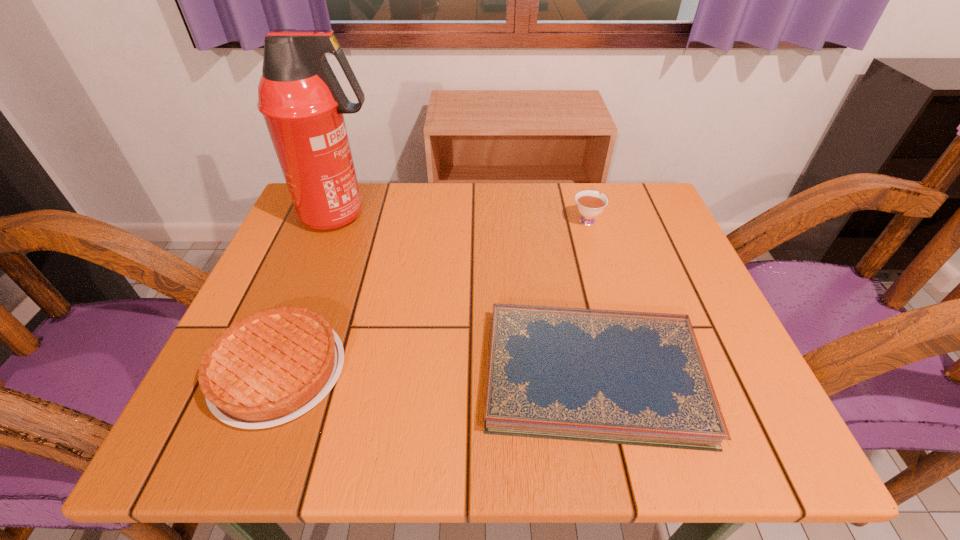
Locate an element on the screen. vacant area that lies between the pie and the paperback book is located at coordinates (436, 373).

The image size is (960, 540). What are the coordinates of `vacant area that lies between the fire extinguisher and the paperback book` in the screenshot? It's located at (468, 295).

Find the location of a particular element. The height and width of the screenshot is (540, 960). free space between the pie and the teacup is located at coordinates (433, 295).

Where is `empty location between the pie and the teacup`? This screenshot has height=540, width=960. empty location between the pie and the teacup is located at coordinates (433, 295).

I want to click on vacant area between the teacup and the shortest object, so click(x=590, y=298).

Identify the location of free space between the fire extinguisher and the teacup. (464, 218).

Where is `blank region between the tallest object and the paperback book`? blank region between the tallest object and the paperback book is located at coordinates (468, 295).

Locate an element on the screen. This screenshot has height=540, width=960. vacant space that is in between the second shortest object and the fire extinguisher is located at coordinates (310, 293).

The height and width of the screenshot is (540, 960). In order to click on vacant area that lies between the second shortest object and the fire extinguisher in this screenshot , I will do `click(310, 293)`.

Identify which object is the second nearest to the teacup. Please provide its 2D coordinates. Your answer should be formatted as a tuple, i.e. [(x, y)], where the tuple contains the x and y coordinates of a point satisfying the conditions above.

[(302, 102)]